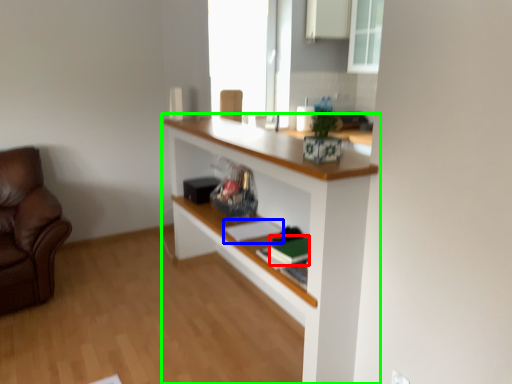
Question: Which object is the closest to the book (highlighted by a red box)? Choose among these: book (highlighted by a blue box) or shelf (highlighted by a green box).

Choices:
 (A) book
 (B) shelf

Answer: (A)